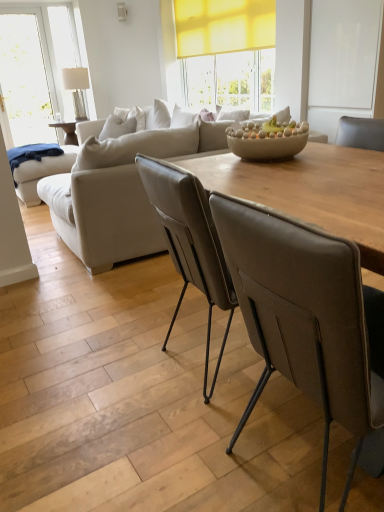
Question: Considering the positions of point (319, 210) and point (326, 410), is point (319, 210) closer or farther from the camera than point (326, 410)?

Choices:
 (A) farther
 (B) closer

Answer: (A)

Question: From the image's perspective, is wooden table at center above or below brown leather chair at center?

Choices:
 (A) below
 (B) above

Answer: (B)

Question: Considering the real-world distances, which object is closest to the beige leather couch at center?

Choices:
 (A) wooden table at center
 (B) clear glass lamp at upper left
 (C) brown leather chair at center

Answer: (A)

Question: Which object is positioned closest to the beige leather couch at center?

Choices:
 (A) clear glass lamp at upper left
 (B) brown leather chair at center
 (C) wooden table at center

Answer: (C)